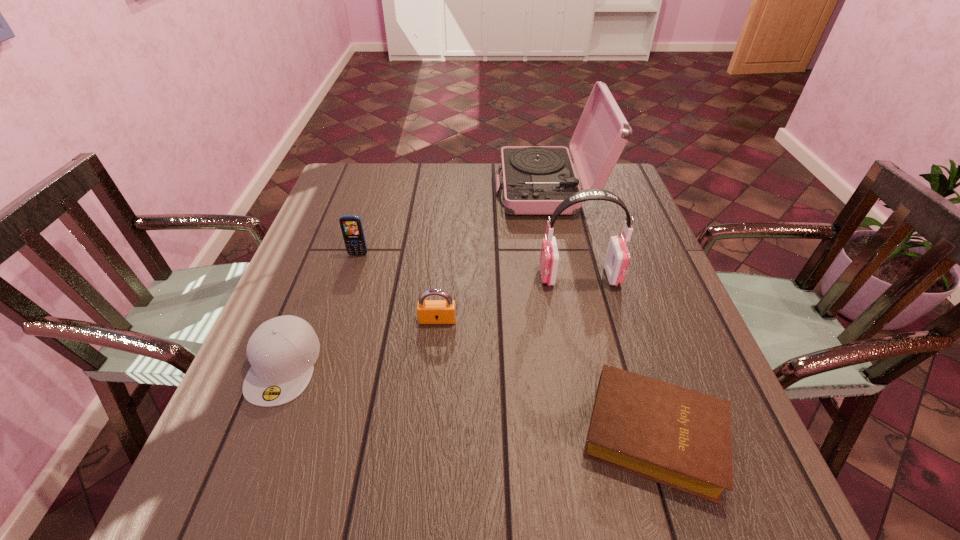
The image size is (960, 540). What are the coordinates of `the farthest object` in the screenshot? It's located at (536, 179).

Find the location of a particular element. The image size is (960, 540). the third farthest object is located at coordinates (617, 258).

Where is `the fifth shortest object`? The height and width of the screenshot is (540, 960). the fifth shortest object is located at coordinates (617, 258).

This screenshot has width=960, height=540. What are the coordinates of `the second farthest object` in the screenshot? It's located at (351, 226).

You are a GUI agent. You are given a task and a screenshot of the screen. Output one action in this format:
    pyautogui.click(x=<x>, y=<y>)
    Task: Click on the third tallest object
    This screenshot has height=540, width=960.
    Given the screenshot: What is the action you would take?
    pyautogui.click(x=351, y=226)

Image resolution: width=960 pixels, height=540 pixels. In order to click on the third object from left to right in this screenshot , I will do `click(428, 311)`.

Find the location of `the third nearest object`. the third nearest object is located at coordinates (428, 311).

Locate an element on the screen. Image resolution: width=960 pixels, height=540 pixels. cap is located at coordinates (282, 351).

Where is `Bible`? Bible is located at coordinates (681, 438).

Locate an element on the screen. This screenshot has height=540, width=960. vacant space located 0.170m with the lid open on the farthest object is located at coordinates click(441, 189).